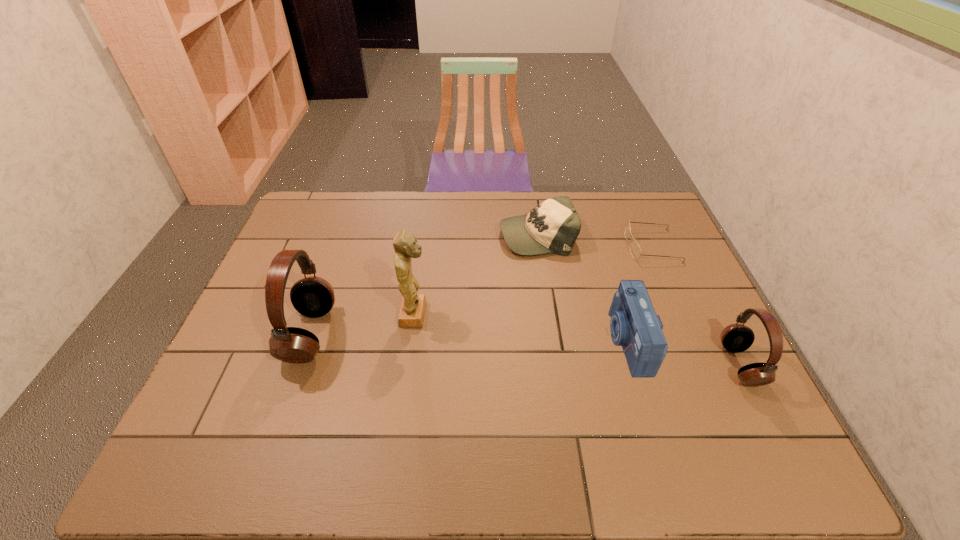
Image resolution: width=960 pixels, height=540 pixels. I want to click on the leftmost object, so click(312, 296).

At what (x,y) coordinates should I click in order to perform the action: click on the left headset. Please return your answer as a coordinate pair (x, y). This screenshot has width=960, height=540. Looking at the image, I should click on (312, 296).

Image resolution: width=960 pixels, height=540 pixels. I want to click on the right headset, so click(x=736, y=337).

Where is `the shorter headset`? the shorter headset is located at coordinates (736, 337).

Image resolution: width=960 pixels, height=540 pixels. I want to click on the third object from left to right, so click(x=553, y=226).

Locate an element on the screen. baseball cap is located at coordinates (553, 226).

Locate an element on the screen. The width and height of the screenshot is (960, 540). the shortest object is located at coordinates [635, 250].

The height and width of the screenshot is (540, 960). What are the coordinates of `figurine` in the screenshot? It's located at (412, 309).

The height and width of the screenshot is (540, 960). Identify the location of the third object from right to left. (634, 325).

Image resolution: width=960 pixels, height=540 pixels. What are the coordinates of `the fourth tallest object` in the screenshot? It's located at (634, 325).